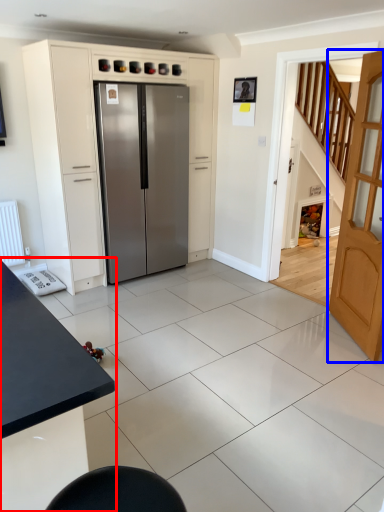
Question: Which object is closer to the camera taking this photo, table (highlighted by a red box) or door (highlighted by a blue box)?

Choices:
 (A) table
 (B) door

Answer: (A)